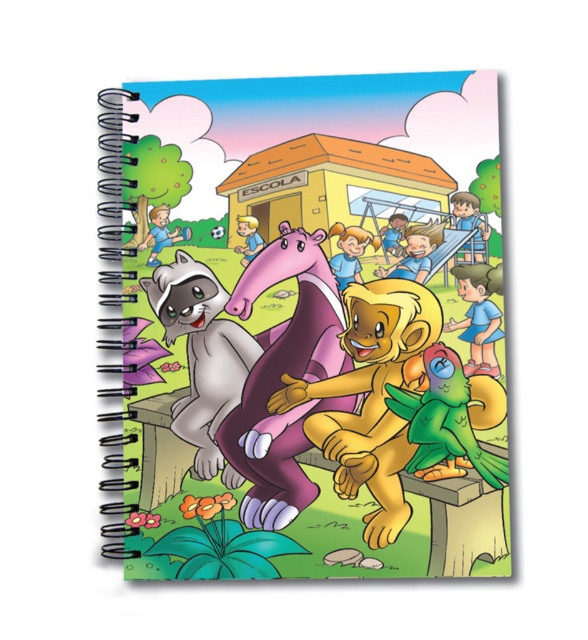
Who is higher up, gray furry raccoon at center or green matte parrot at center?

Positioned higher is gray furry raccoon at center.

Does gray furry raccoon at center appear on the left side of green matte parrot at center?

Correct, you'll find gray furry raccoon at center to the left of green matte parrot at center.

Is point (171, 301) more distant than point (459, 470)?

Yes, it is behind point (459, 470).

Locate an element on the screen. gray furry raccoon at center is located at coordinates (202, 355).

Which is behind, point (236, 284) or point (389, 486)?

Positioned behind is point (236, 284).

Which is more to the left, purple matte hippo at center or yellow matte lion at center?

Positioned to the left is purple matte hippo at center.

Which is behind, point (303, 496) or point (352, 288)?

Positioned behind is point (352, 288).

Where is `purple matte hippo at center`? The width and height of the screenshot is (588, 640). purple matte hippo at center is located at coordinates (282, 380).

Is yellow matte lion at center wider than green matte parrot at center?

Yes.

Who is more distant from viewer, (x=369, y=296) or (x=402, y=410)?

The point (x=369, y=296) is behind.

The width and height of the screenshot is (588, 640). Identify the location of yellow matte lion at center. click(x=372, y=396).